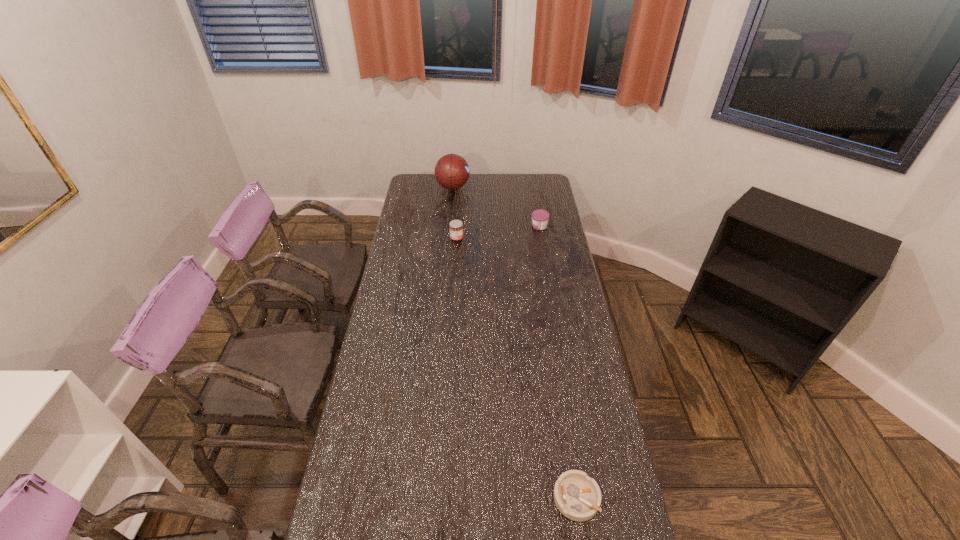
Find the location of `free space located 0.270m on the front label of the third nearest object`. free space located 0.270m on the front label of the third nearest object is located at coordinates (475, 226).

The image size is (960, 540). In order to click on free space located 0.130m on the front label of the third nearest object in this screenshot , I will do `click(504, 226)`.

Where is `vacant space located 0.220m on the front label of the third nearest object`? vacant space located 0.220m on the front label of the third nearest object is located at coordinates (486, 226).

At what (x,y) coordinates should I click in order to perform the action: click on free space located on the back of the shortest object. Please return your answer as a coordinate pair (x, y). The width and height of the screenshot is (960, 540). Looking at the image, I should click on (564, 418).

Identify the location of object present at the far edge. The image size is (960, 540). (452, 171).

At what (x,y) coordinates should I click in order to perform the action: click on object that is at the left edge. Please return your answer as a coordinate pair (x, y). Looking at the image, I should click on click(452, 171).

This screenshot has height=540, width=960. Identify the location of jam that is at the right edge. (540, 217).

Identify the location of ashtray that is positioned at the right edge. (577, 496).

This screenshot has width=960, height=540. Identify the location of object that is at the far left corner. (452, 171).

I want to click on vacant space at the left edge of the desktop, so click(413, 210).